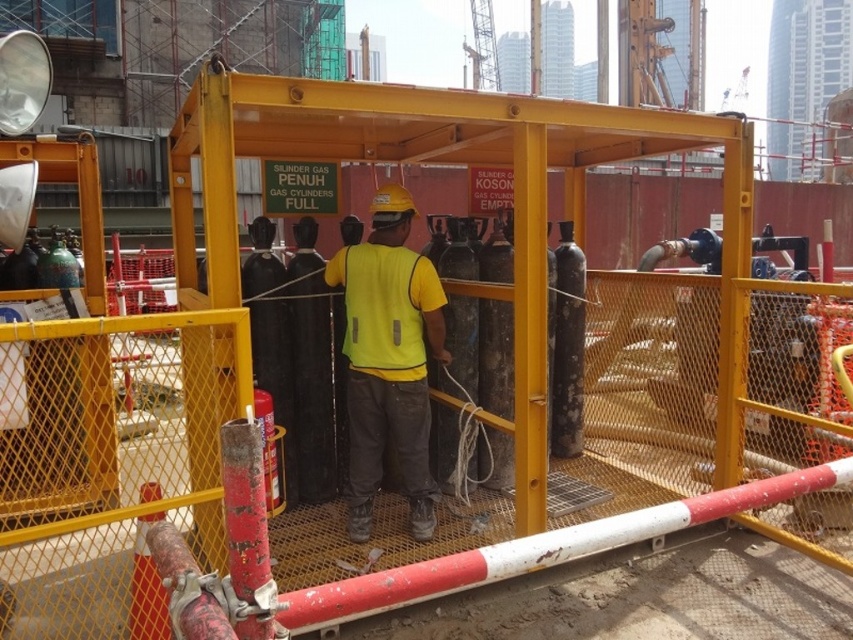
You are a safety inspector at the construction site and need to determine the distance between two points where workers are handling cylinders. The points are point [335,275] and point [379,346]. Based on their positions relative to the camera, which point is closer to you?

Point [379,346] is closer to you because it is less further to the camera than point [335,275].

What is the exact coordinate of the yellow reflective vest at center?

The yellow reflective vest at center is located at point (387,358).